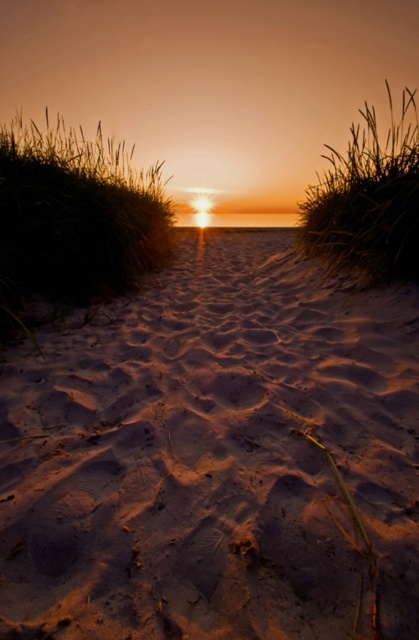
Question: Is sandy textured path at center above silvery grass at left?

Choices:
 (A) no
 (B) yes

Answer: (A)

Question: Which of these objects is positioned closest to the sandy textured path at center?

Choices:
 (A) silvery grass at left
 (B) silvery grass at upper right

Answer: (B)

Question: Which point appears farthest from the camera in this image?

Choices:
 (A) click(403, 243)
 (B) click(127, 227)
 (C) click(103, 461)

Answer: (B)

Question: Is silvery grass at left further to the viewer compared to silvery grass at upper right?

Choices:
 (A) no
 (B) yes

Answer: (B)

Question: Is silvery grass at left in front of silvery grass at upper right?

Choices:
 (A) no
 (B) yes

Answer: (A)

Question: Among these objects, which one is farthest from the camera?

Choices:
 (A) sandy textured path at center
 (B) silvery grass at upper right

Answer: (B)